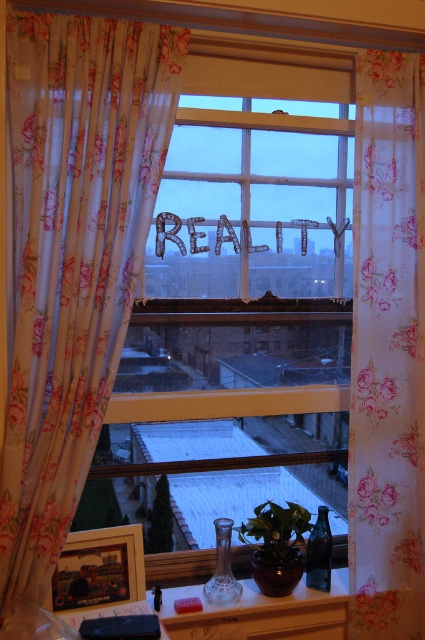
You are an interior designer assessing the windowsill space. You have a new decorative item that is 12 inches wide. The floral fabric curtain at center and the green matte plant at center are already occupying space. Can you place the new item between them without moving either existing item?

The floral fabric curtain at center is wider than the green matte plant at center. Since the curtain is wider, there might be limited space between them. However, without exact measurements, it is uncertain if the 12 inch item will fit. Consider measuring the gap first.

You are a delivery person who needs to place a package on the windowsill. The package is 5 feet long. There is a floral fabric curtain at center and a camera on the windowsill. Can the package fit between them?

The distance between the floral fabric curtain at center and the camera is 5.55 feet. Since the package is 5 feet long, it can fit between them as there is enough space.

You are arranging flowers in the matte glass vase at lower center and want to ensure it doesn not topple over. Considering the green matte plant at center is taller, which object should you place closer to the edge of the windowsill to maintain balance?

The matte glass vase at lower center has a lesser height compared to the green matte plant at center, so placing the green matte plant at center closer to the edge would help balance the arrangement since it is taller and potentially heavier.